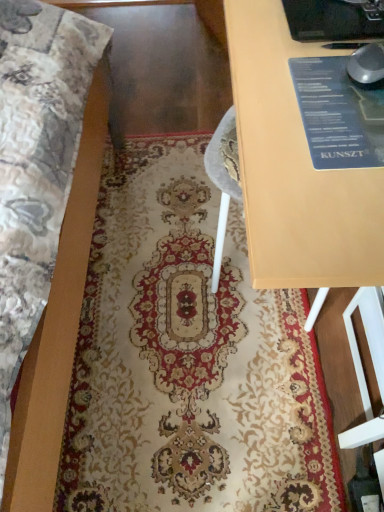
Locate an element on the screen. The image size is (384, 512). matte wood table at center is located at coordinates (308, 143).

The height and width of the screenshot is (512, 384). Describe the element at coordinates (308, 143) in the screenshot. I see `matte wood table at center` at that location.

This screenshot has width=384, height=512. Describe the element at coordinates (188, 359) in the screenshot. I see `carpet with intricate patterns at center` at that location.

Where is `carpet with intricate patterns at center`? The image size is (384, 512). carpet with intricate patterns at center is located at coordinates (188, 359).

Image resolution: width=384 pixels, height=512 pixels. I want to click on matte wood table at center, so click(308, 143).

Can you confirm if carpet with intricate patterns at center is positioned to the left of matte wood table at center?

Yes, carpet with intricate patterns at center is to the left of matte wood table at center.

Is carpet with intricate patterns at center behind matte wood table at center?

Yes, carpet with intricate patterns at center is further from the viewer.

Does point (106, 431) appear closer or farther from the camera than point (338, 128)?

Point (106, 431) is farther from the camera than point (338, 128).

Looking at this image, from the image's perspective, is carpet with intricate patterns at center located above matte wood table at center?

No, from the image's perspective, carpet with intricate patterns at center is not on top of matte wood table at center.

From a real-world perspective, which is physically below, carpet with intricate patterns at center or matte wood table at center?

In real-world perspective, carpet with intricate patterns at center is lower.

Does carpet with intricate patterns at center have a greater width compared to matte wood table at center?

Yes, carpet with intricate patterns at center is wider than matte wood table at center.

Who is taller, carpet with intricate patterns at center or matte wood table at center?

With more height is matte wood table at center.

Looking at this image, between carpet with intricate patterns at center and matte wood table at center, which one has larger size?

Bigger between the two is matte wood table at center.

Can matte wood table at center be found inside carpet with intricate patterns at center?

No, matte wood table at center is located outside of carpet with intricate patterns at center.

Consider the image. Are carpet with intricate patterns at center and matte wood table at center beside each other?

No, carpet with intricate patterns at center is not beside matte wood table at center.

Is carpet with intricate patterns at center aimed at matte wood table at center?

No, carpet with intricate patterns at center is not turned towards matte wood table at center.

In the scene shown: What's the angular difference between carpet with intricate patterns at center and matte wood table at center's facing directions?

The facing directions of carpet with intricate patterns at center and matte wood table at center are 0.000243 degrees apart.

You are a GUI agent. You are given a task and a screenshot of the screen. Output one action in this format:
    pyautogui.click(x=<x>, y=<y>)
    Task: Click on the table lying on the right of carpet with intricate patterns at center
    The width and height of the screenshot is (384, 512).
    Given the screenshot: What is the action you would take?
    coord(308,143)

Is matte wood table at center to the left or to the right of carpet with intricate patterns at center in the image?

Clearly, matte wood table at center is on the right of carpet with intricate patterns at center in the image.

Does matte wood table at center come in front of carpet with intricate patterns at center?

Yes, it is.

Considering the positions of point (260, 72) and point (284, 433), is point (260, 72) closer or farther from the camera than point (284, 433)?

Point (260, 72) is closer to the camera than point (284, 433).

From the image's perspective, would you say matte wood table at center is shown under carpet with intricate patterns at center?

No.

From a real-world perspective, which object stands above the other?

matte wood table at center, from a real-world perspective.

Which of these two, matte wood table at center or carpet with intricate patterns at center, is thinner?

Thinner between the two is matte wood table at center.

Which of these two, matte wood table at center or carpet with intricate patterns at center, stands taller?

matte wood table at center.

Which of these two, matte wood table at center or carpet with intricate patterns at center, is smaller?

carpet with intricate patterns at center.

Can carpet with intricate patterns at center be found inside matte wood table at center?

No, carpet with intricate patterns at center is not a part of matte wood table at center.

Is matte wood table at center not near carpet with intricate patterns at center?

matte wood table at center is actually quite close to carpet with intricate patterns at center.

Is matte wood table at center positioned with its back to carpet with intricate patterns at center?

No.

Measure the distance between matte wood table at center and carpet with intricate patterns at center.

matte wood table at center and carpet with intricate patterns at center are 74.19 centimeters apart.

Identify the location of table on the right of carpet with intricate patterns at center. The width and height of the screenshot is (384, 512). (308, 143).

Find the location of a particular element. This screenshot has height=512, width=384. mat beneath the matte wood table at center (from a real-world perspective) is located at coordinates (188, 359).

You are a GUI agent. You are given a task and a screenshot of the screen. Output one action in this format:
    pyautogui.click(x=<x>, y=<y>)
    Task: Click on the table in front of the carpet with intricate patterns at center
    
    Given the screenshot: What is the action you would take?
    pyautogui.click(x=308, y=143)